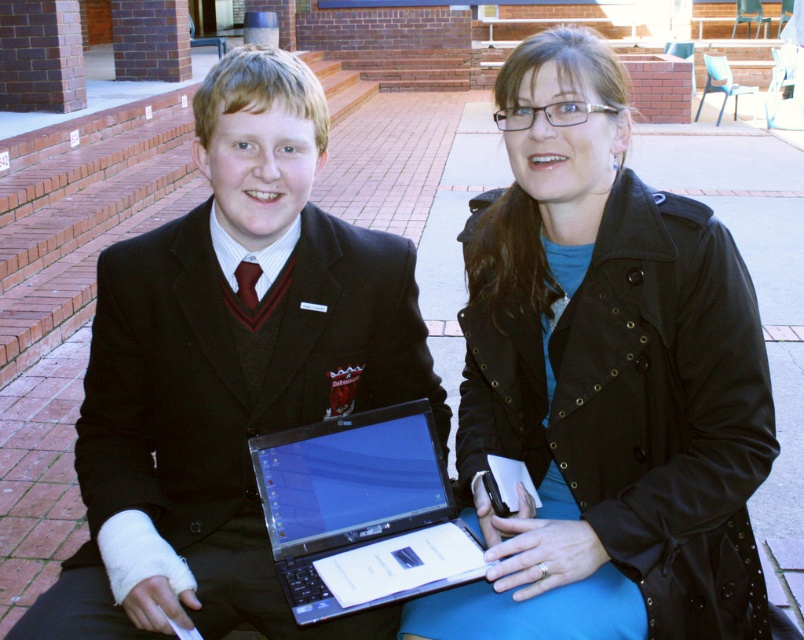
Question: Which object is the farthest from the matte black jacket at center?

Choices:
 (A) black matte suit at center
 (B) silver metallic laptop at center

Answer: (A)

Question: Is matte black jacket at center smaller than black matte suit at center?

Choices:
 (A) yes
 (B) no

Answer: (B)

Question: Among these points, which one is farthest from the camera?

Choices:
 (A) (286, 99)
 (B) (320, 465)
 (C) (663, 296)

Answer: (B)

Question: Which object is farther from the camera taking this photo?

Choices:
 (A) silver metallic laptop at center
 (B) black matte suit at center
 (C) matte black jacket at center

Answer: (B)

Question: Is matte black jacket at center behind black matte suit at center?

Choices:
 (A) no
 (B) yes

Answer: (A)

Question: Can you confirm if matte black jacket at center is positioned below silver metallic laptop at center?

Choices:
 (A) yes
 (B) no

Answer: (B)